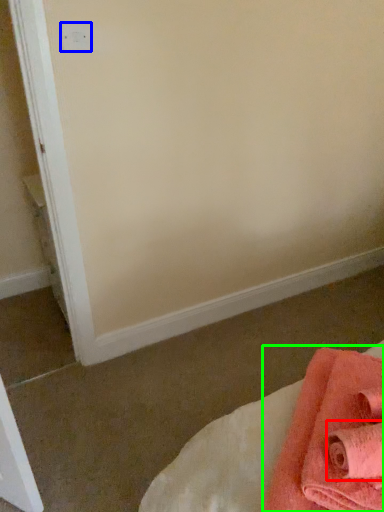
Question: Which is nearer to the bath towel (highlighted by a red box)? electric outlet (highlighted by a blue box) or towel (highlighted by a green box).

Choices:
 (A) electric outlet
 (B) towel

Answer: (B)